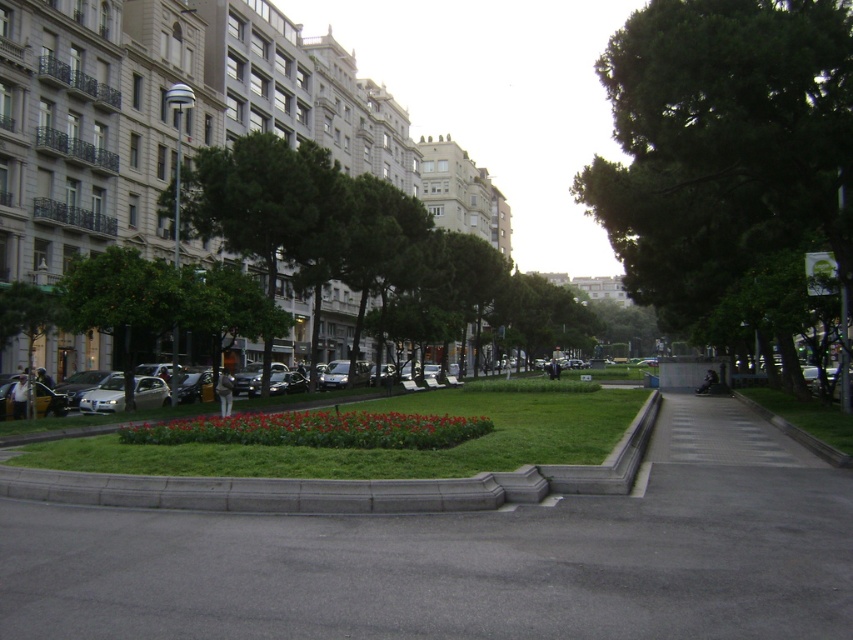
Question: Does gray asphalt pavement at center appear on the right side of gray concrete curb at lower center?

Choices:
 (A) yes
 (B) no

Answer: (A)

Question: Which of the following is the closest to the observer?

Choices:
 (A) (9, 490)
 (B) (572, 577)
 (C) (494, 420)

Answer: (B)

Question: Observing the image, what is the correct spatial positioning of green grass at center in reference to green grass at lower right?

Choices:
 (A) below
 (B) above

Answer: (A)

Question: Which point is closer to the camera taking this photo?

Choices:
 (A) (834, 420)
 (B) (503, 440)

Answer: (B)

Question: Which object is farther from the camera taking this photo?

Choices:
 (A) green grass at center
 (B) gray asphalt pavement at center
 (C) green grass at lower right
 (D) green leafy tree at center

Answer: (D)

Question: Can you confirm if green leafy tree at center is thinner than gray concrete curb at lower center?

Choices:
 (A) no
 (B) yes

Answer: (A)